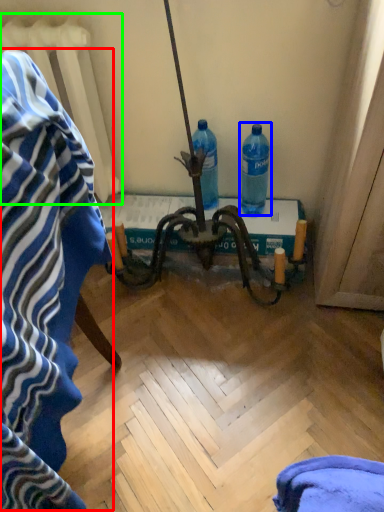
Question: Which is nearer to the bath towel (highlighted by a red box)? bottle (highlighted by a blue box) or radiator (highlighted by a green box).

Choices:
 (A) bottle
 (B) radiator

Answer: (B)